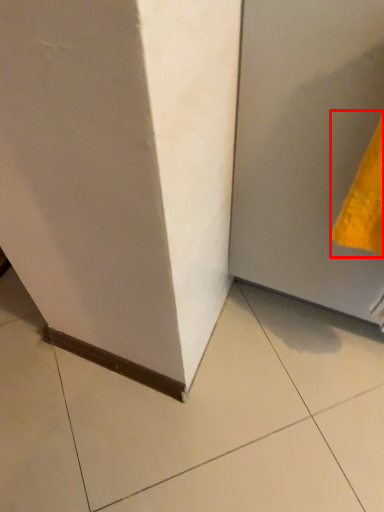
Question: From the image's perspective, what is the correct spatial relationship of hand towel (annotated by the red box) in relation to door?

Choices:
 (A) above
 (B) below

Answer: (B)